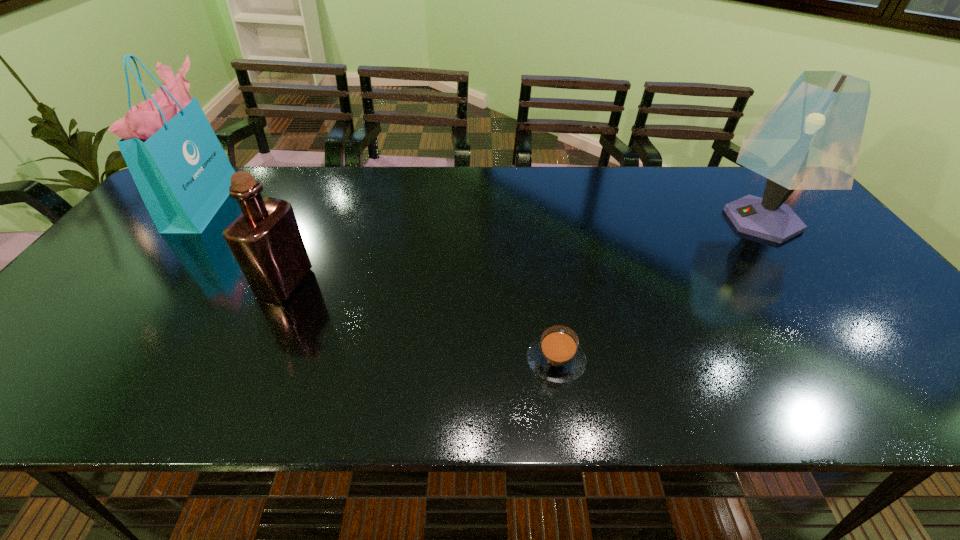
Where is `vacant space in between the lampshade and the third farthest object`? vacant space in between the lampshade and the third farthest object is located at coordinates (523, 251).

Find the location of a particular element. This screenshot has width=960, height=540. object that is the second nearest to the third tallest object is located at coordinates (556, 356).

Identify which object is the third closest to the shortest object. Please provide its 2D coordinates. Your answer should be formatted as a tuple, i.e. [(x, y)], where the tuple contains the x and y coordinates of a point satisfying the conditions above.

[(182, 173)]

Image resolution: width=960 pixels, height=540 pixels. Identify the location of free space that satisfies the following two spatial constraints: 1. on the front side of the shortest object; 2. on the right side of the shopping bag. (81, 361).

Identify the location of vacant point that satisfies the following two spatial constraints: 1. on the base of the rightmost object; 2. on the front side of the liquor. (810, 282).